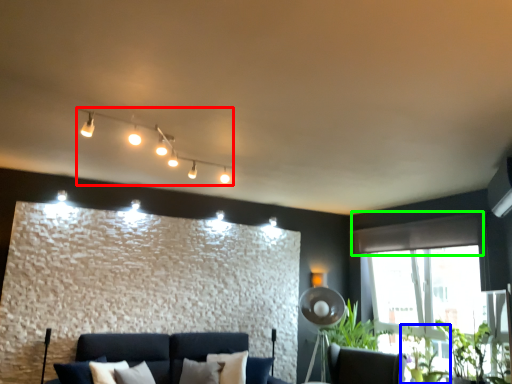
Question: Considering the real-world distances, which object is closest to lamp (highlighted by a red box)? plant (highlighted by a blue box) or curtain (highlighted by a green box).

Choices:
 (A) plant
 (B) curtain

Answer: (B)